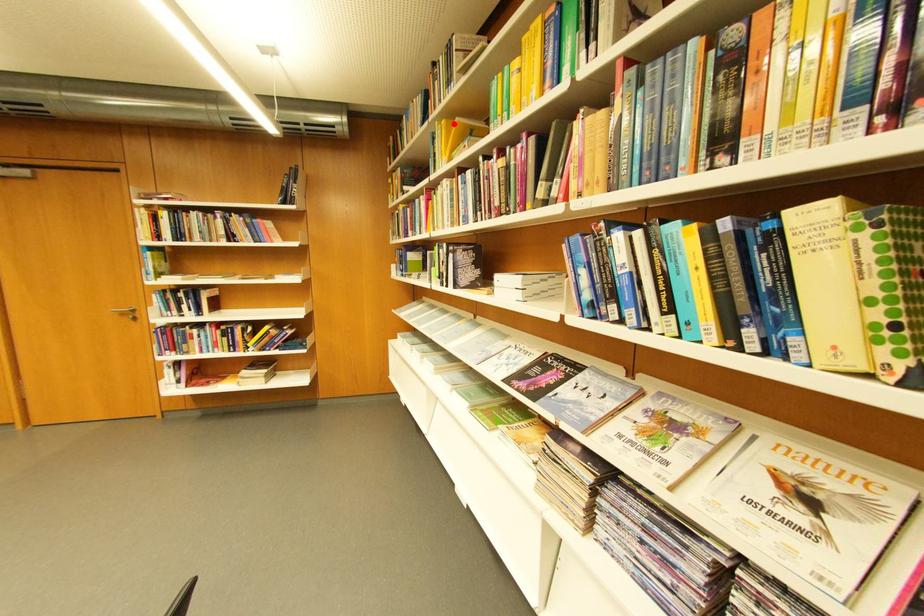
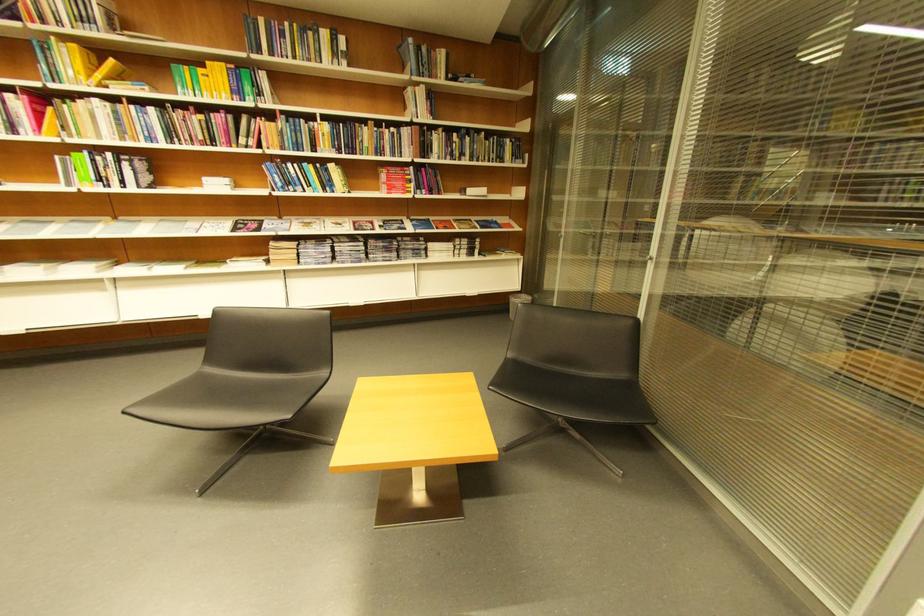
Locate, in the second image, the point that corresponds to the highlighted location in the first image.

(84, 47)